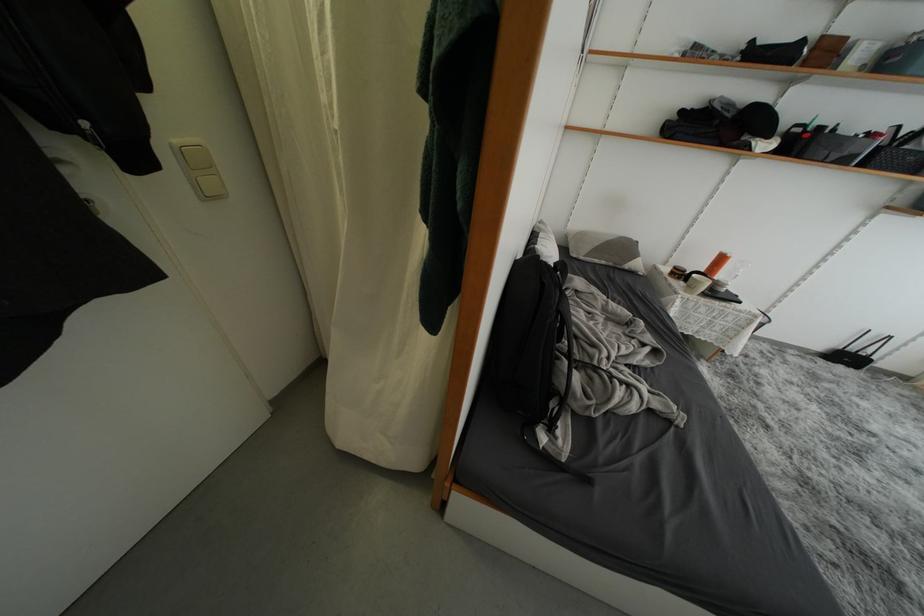
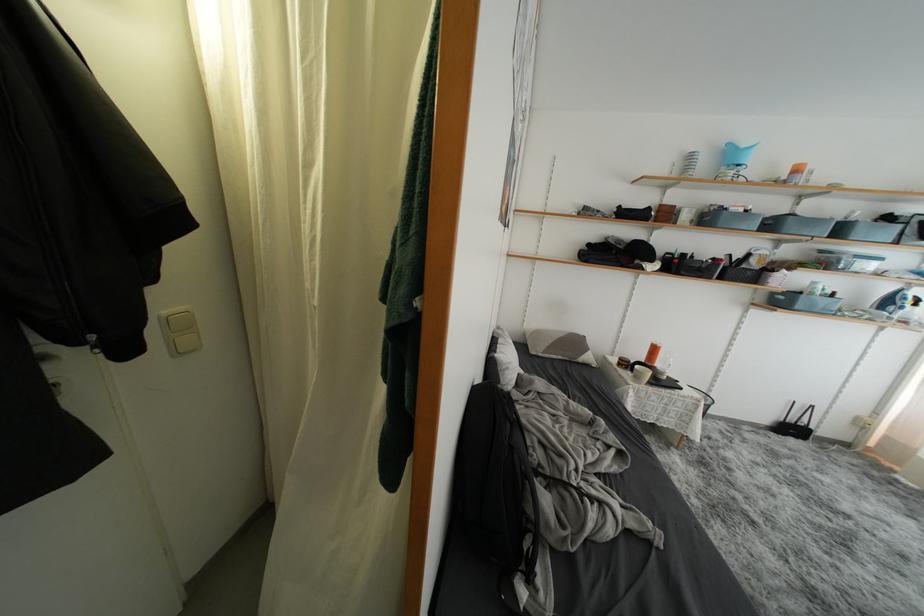
Where in the second image is the point corresponding to point 187,156 from the first image?

(172, 325)